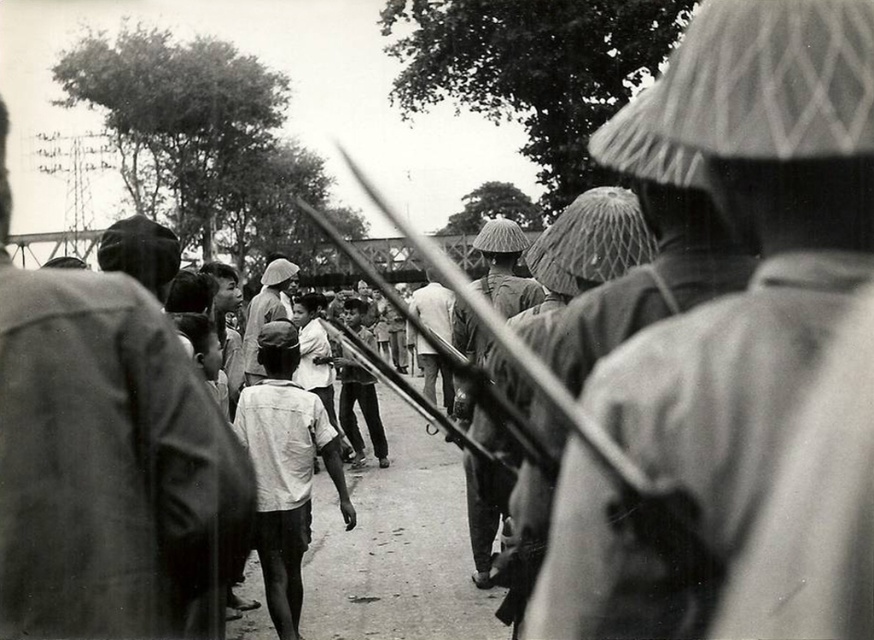
Who is higher up, dark gray cloth jacket at left or white cotton shirt at center?

Positioned higher is dark gray cloth jacket at left.

Which is in front, point (143, 486) or point (281, 544)?

Point (143, 486)

Where is `dark gray cloth jacket at left`? dark gray cloth jacket at left is located at coordinates (105, 460).

How much distance is there between textured straw hat at center and white cotton shirt at center?

textured straw hat at center is 3.24 meters from white cotton shirt at center.

Is point (712, 525) farther from camera compared to point (282, 609)?

No, (712, 525) is closer to viewer.

Locate an element on the screen. This screenshot has width=874, height=640. textured straw hat at center is located at coordinates (720, 310).

Describe the element at coordinates (720, 310) in the screenshot. I see `textured straw hat at center` at that location.

Can you confirm if textured straw hat at center is wider than dark gray cloth jacket at left?

No, textured straw hat at center is not wider than dark gray cloth jacket at left.

This screenshot has width=874, height=640. Identify the location of textured straw hat at center. (720, 310).